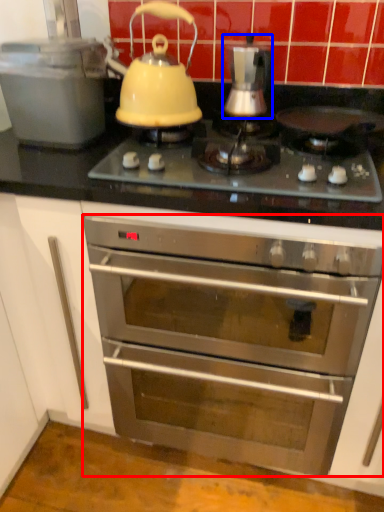
Question: Which point is further to the camera, oven (highlighted by a red box) or kitchen appliance (highlighted by a blue box)?

Choices:
 (A) oven
 (B) kitchen appliance

Answer: (B)